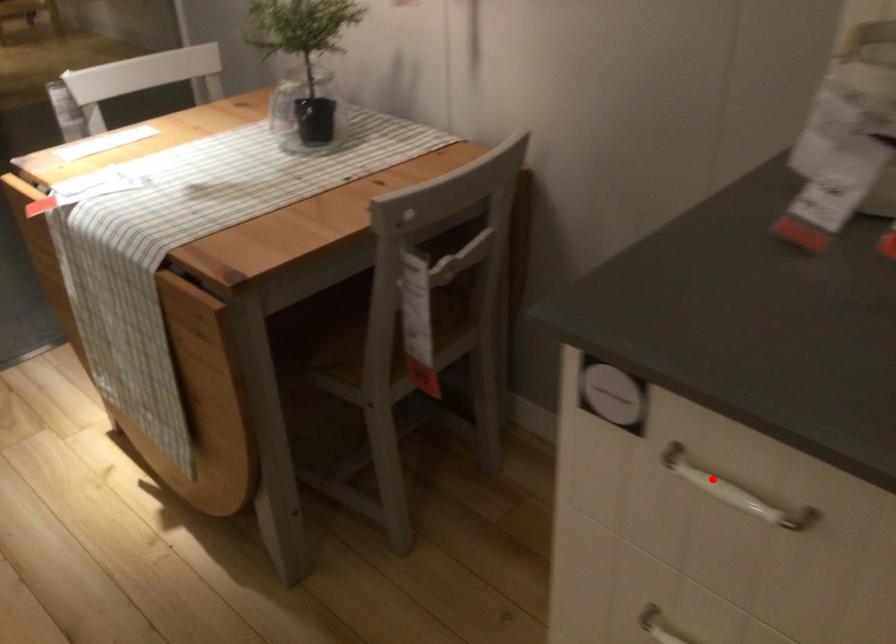
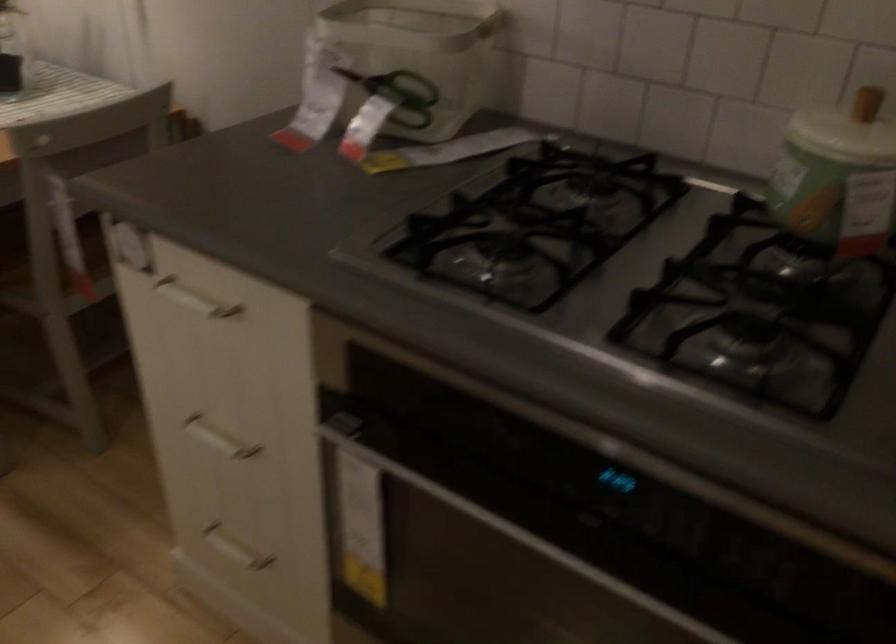
Question: I am providing you with two images of the same scene from different viewpoints. Image1 has a red point marked. In image2, the corresponding 3D location appears at what relative position? Reply with the corresponding letter.

Choices:
 (A) Closer
 (B) Farther

Answer: (B)